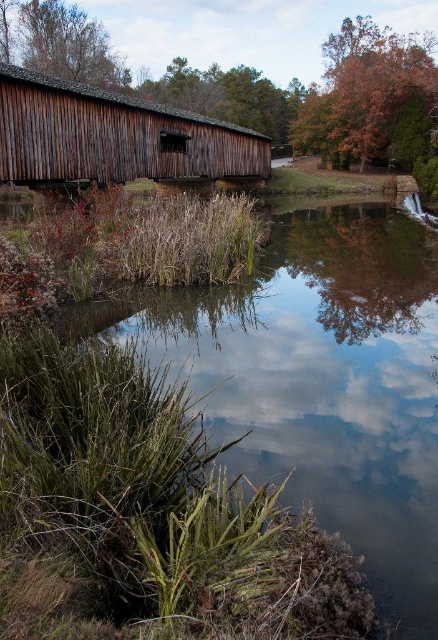
You are standing on the wooden bridge at left and looking towards the green grassy water at lower left. Which object is closer to you?

The green grassy water at lower left is closer to you since it is in front of the wooden bridge at left.